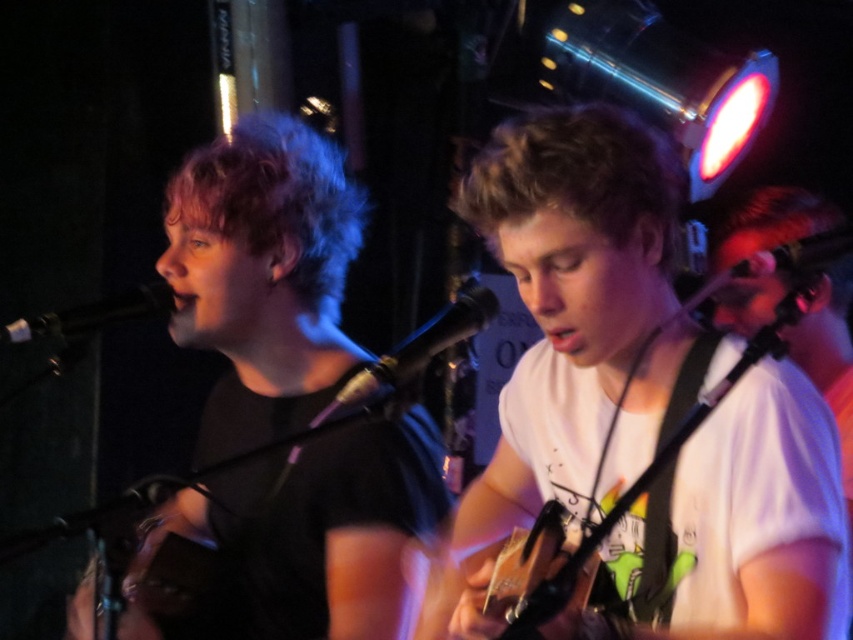
Who is more forward, (666, 276) or (473, 316)?

Point (666, 276) is more forward.

Is point (560, 326) positioned after point (340, 397)?

No, (560, 326) is closer to viewer.

I want to click on white matte guitar at center, so click(x=572, y=330).

Who is more distant from viewer, (x=554, y=490) or (x=170, y=308)?

Point (x=170, y=308)

At what (x,y) coordinates should I click in order to perform the action: click on white matte guitar at center. Please return your answer as a coordinate pair (x, y). Looking at the image, I should click on (572, 330).

Based on the photo, measure the distance from wooden acoustic guitar at center to black metallic microphone at left.

wooden acoustic guitar at center is 30.62 inches from black metallic microphone at left.

Identify the location of wooden acoustic guitar at center. The width and height of the screenshot is (853, 640). (543, 570).